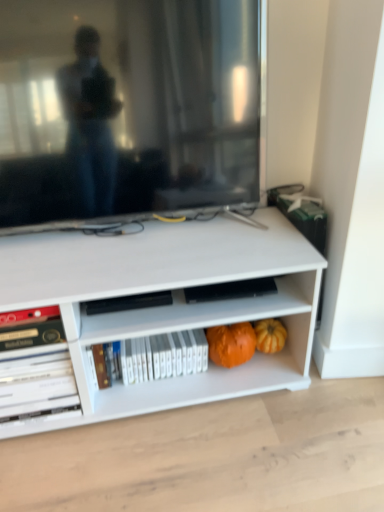
Question: Looking at the image, does matte black television at upper center seem bigger or smaller compared to orange matte pumpkin at lower center, which is the first pumpkin in left-to-right order?

Choices:
 (A) small
 (B) big

Answer: (B)

Question: Looking at their shapes, would you say matte black television at upper center is wider or thinner than orange matte pumpkin at lower center, which is the first pumpkin in left-to-right order?

Choices:
 (A) wide
 (B) thin

Answer: (A)

Question: Based on their relative distances, which object is nearer to the orange matte pumpkin at lower center, the second pumpkin viewed from the right?

Choices:
 (A) white glossy book at lower left, marked as the second book in a right-to-left arrangement
 (B) white glossy bookshelf at center, the first book positioned from the right
 (C) matte black television at upper center
 (D) orange matte pumpkin at lower right, placed as the 2th pumpkin when sorted from left to right

Answer: (D)

Question: Which object is positioned closest to the white glossy book at lower left, the first book from the left?

Choices:
 (A) orange matte pumpkin at lower center, the second pumpkin viewed from the right
 (B) matte black television at upper center
 (C) white glossy bookshelf at center, the first book positioned from the right
 (D) orange matte pumpkin at lower right, placed as the 2th pumpkin when sorted from left to right

Answer: (C)